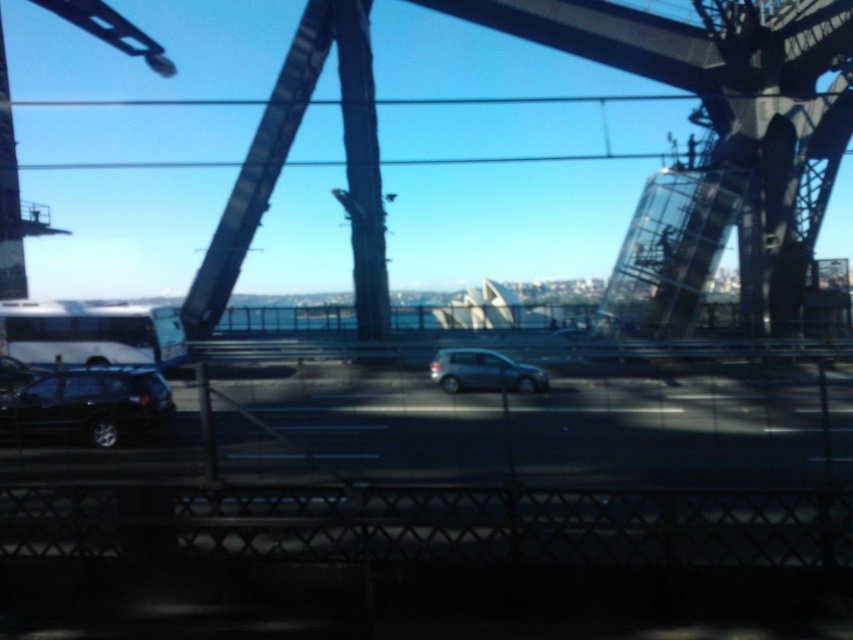
Can you confirm if shiny black suv at lower left is taller than shiny black sedan at lower left?

Yes, shiny black suv at lower left is taller than shiny black sedan at lower left.

Measure the distance between point (10, 432) and camera.

Point (10, 432) and camera are 46.90 feet apart.

This screenshot has width=853, height=640. What do you see at coordinates (86, 404) in the screenshot?
I see `shiny black suv at lower left` at bounding box center [86, 404].

At what (x,y) coordinates should I click in order to perform the action: click on shiny black suv at lower left. Please return your answer as a coordinate pair (x, y). Looking at the image, I should click on (86, 404).

Does black metal bridge at center appear under shiny black suv at lower left?

Incorrect, black metal bridge at center is not positioned below shiny black suv at lower left.

Can you confirm if black metal bridge at center is wider than shiny black suv at lower left?

Yes, black metal bridge at center is wider than shiny black suv at lower left.

Between point (688, 65) and point (15, 420), which one is positioned in front?

Point (15, 420) is more forward.

I want to click on black metal bridge at center, so click(722, 129).

Does satin silver car at center have a lesser height compared to shiny black sedan at lower left?

In fact, satin silver car at center may be taller than shiny black sedan at lower left.

Who is more distant from viewer, [456,349] or [28,372]?

The point [456,349] is more distant.

Image resolution: width=853 pixels, height=640 pixels. Describe the element at coordinates (483, 371) in the screenshot. I see `satin silver car at center` at that location.

The image size is (853, 640). In order to click on satin silver car at center in this screenshot , I will do `click(483, 371)`.